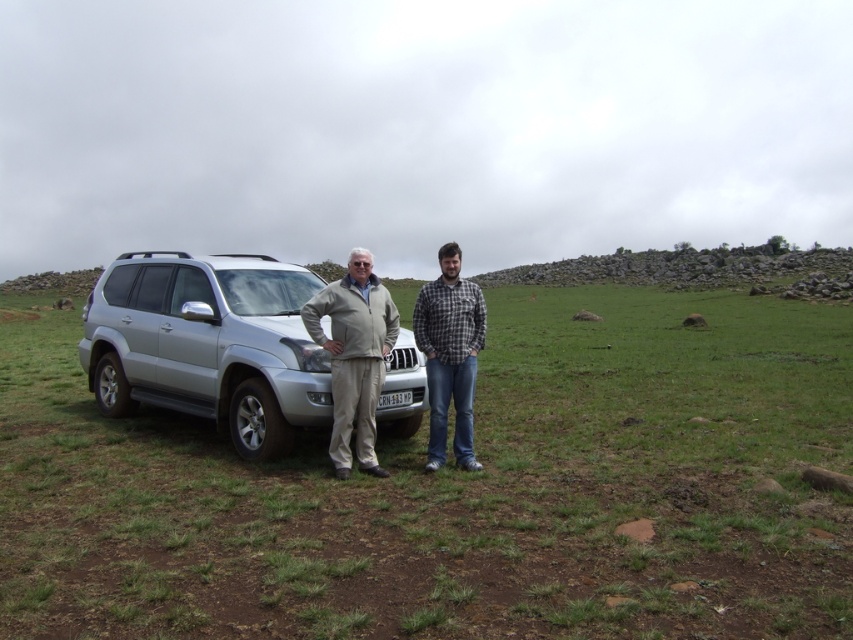
Question: Can you confirm if silver metallic suv at center is smaller than plaid flannel shirt at center?

Choices:
 (A) no
 (B) yes

Answer: (A)

Question: Considering the real-world distances, which object is closest to the green grassy field at center?

Choices:
 (A) light gray fabric jacket at center
 (B) silver metallic suv at center

Answer: (B)

Question: Does silver metallic suv at center have a smaller size compared to light gray fabric jacket at center?

Choices:
 (A) yes
 (B) no

Answer: (B)

Question: Which object appears farthest from the camera in this image?

Choices:
 (A) green grassy field at center
 (B) plaid flannel shirt at center
 (C) silver metallic suv at center

Answer: (B)

Question: Estimate the real-world distances between objects in this image. Which object is farther from the green grassy field at center?

Choices:
 (A) light gray fabric jacket at center
 (B) silver metallic suv at center

Answer: (A)

Question: Does green grassy field at center appear over plaid flannel shirt at center?

Choices:
 (A) no
 (B) yes

Answer: (A)